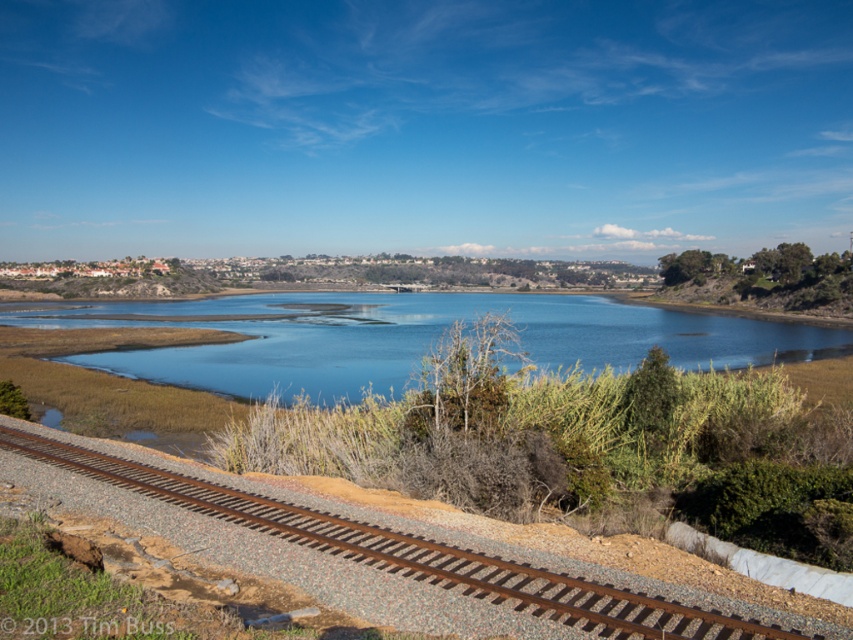
Question: Does blue water at center have a lesser width compared to rusty metal track at lower left?

Choices:
 (A) no
 (B) yes

Answer: (A)

Question: Can you confirm if blue water at center is bigger than rusty metal track at lower left?

Choices:
 (A) no
 (B) yes

Answer: (B)

Question: Among these objects, which one is farthest from the camera?

Choices:
 (A) blue water at center
 (B) rusty metal track at lower left

Answer: (A)

Question: Which point appears farthest from the camera in this image?

Choices:
 (A) (397, 563)
 (B) (279, 292)

Answer: (B)

Question: Which point is farther to the camera?

Choices:
 (A) (215, 312)
 (B) (624, 609)

Answer: (A)

Question: Can you confirm if blue water at center is positioned below rusty metal track at lower left?

Choices:
 (A) yes
 (B) no

Answer: (B)